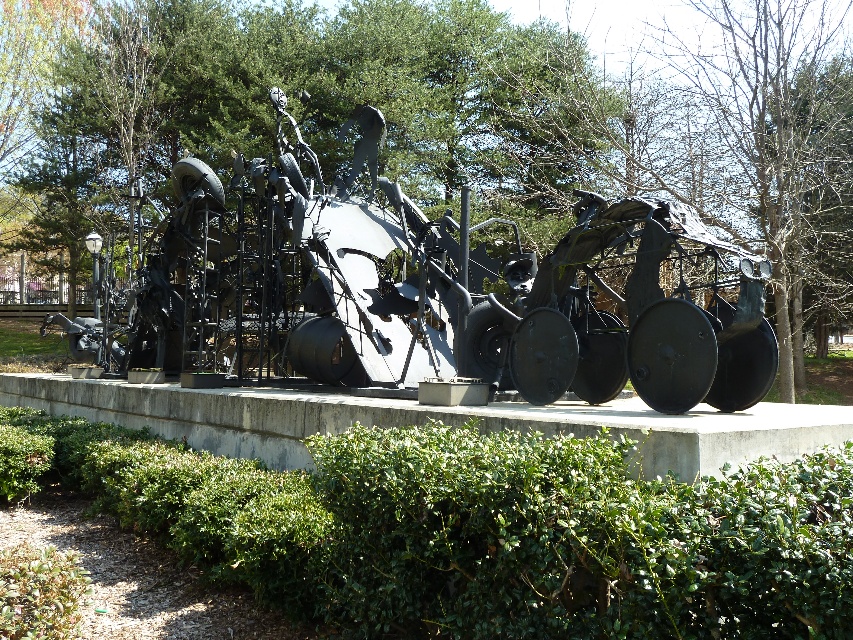
Question: From the image, what is the correct spatial relationship of green leafy hedge at center in relation to black metal sculpture at center?

Choices:
 (A) below
 (B) above

Answer: (A)

Question: In this image, where is green leafy hedge at center located relative to black metal sculpture at center?

Choices:
 (A) right
 (B) left

Answer: (A)

Question: Which point is closer to the camera?

Choices:
 (A) black metal sculpture at center
 (B) green leafy hedge at center

Answer: (B)

Question: Can you confirm if green leafy hedge at center is positioned below black metal sculpture at center?

Choices:
 (A) yes
 (B) no

Answer: (A)